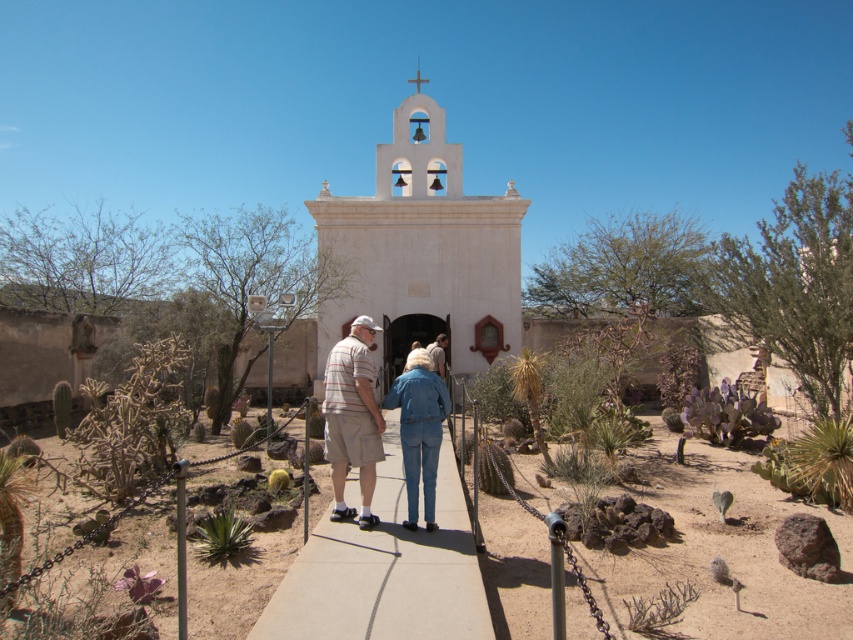
You are standing at the entrance of the white stucco chapel at center and want to hand a denim jacket at center to a friend who is standing behind the chapel. Can you directly hand it to them without moving from your current position?

The white stucco chapel at center is further to the viewer than the denim jacket at center, so the chapel is between you and your friend. You cannot directly hand the denim jacket at center to them without moving because the chapel blocks the path.